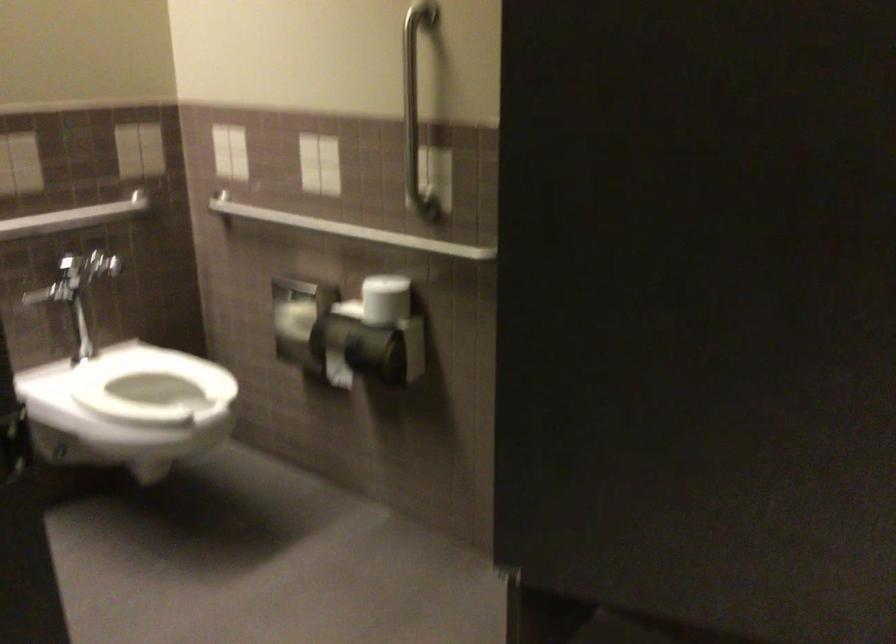
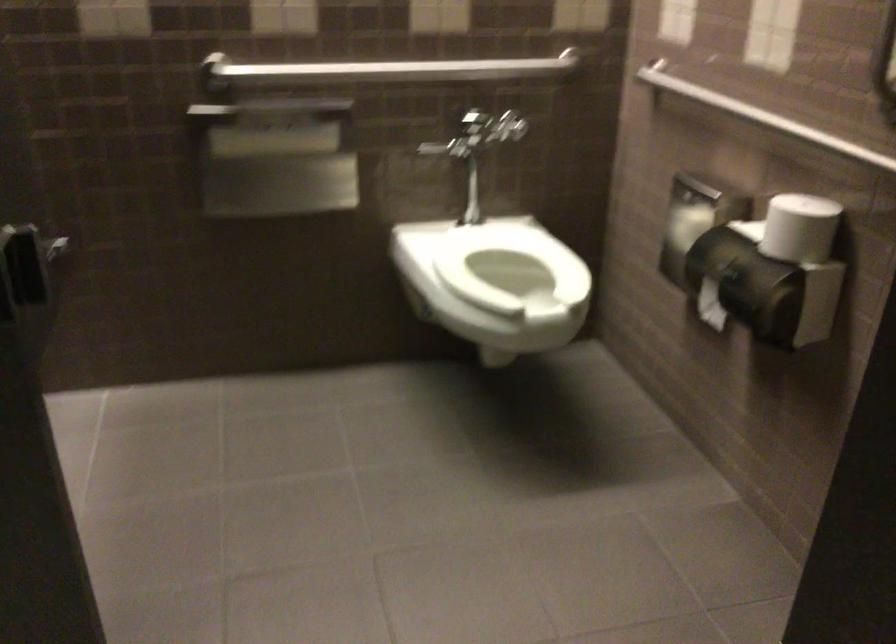
Locate, in the second image, the point that corresponds to the point at 147,383 in the first image.

(509, 263)